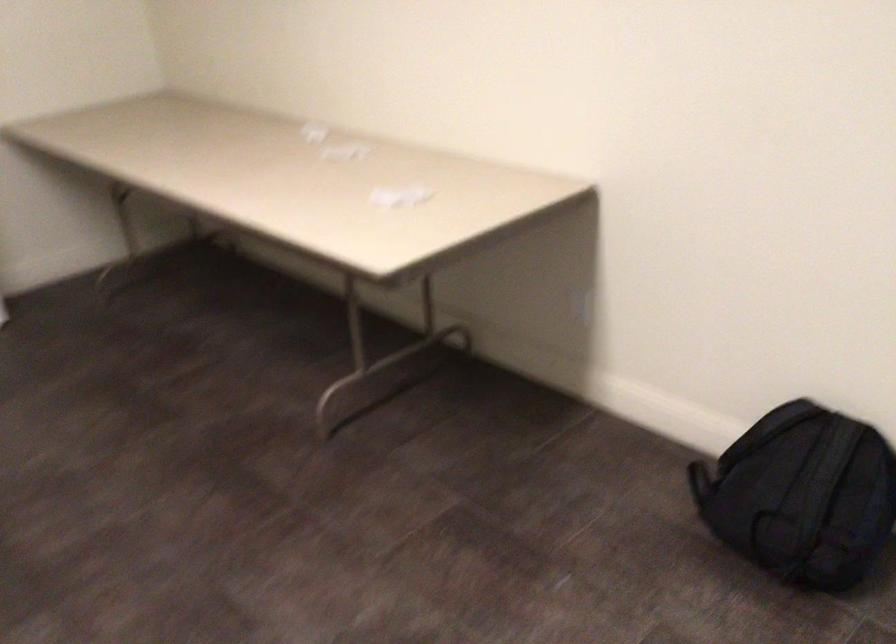
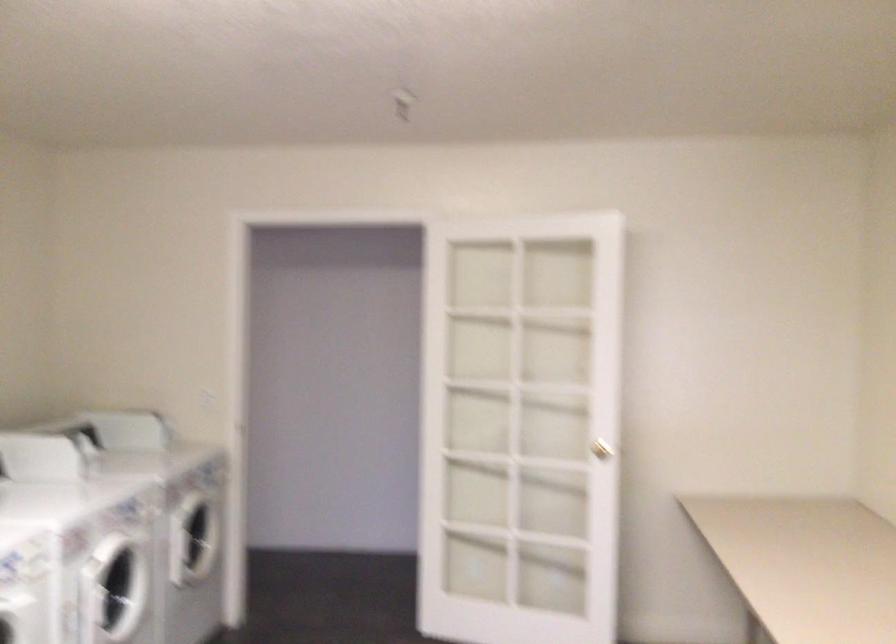
How did the camera likely rotate?

The camera's rotation is toward left-up.